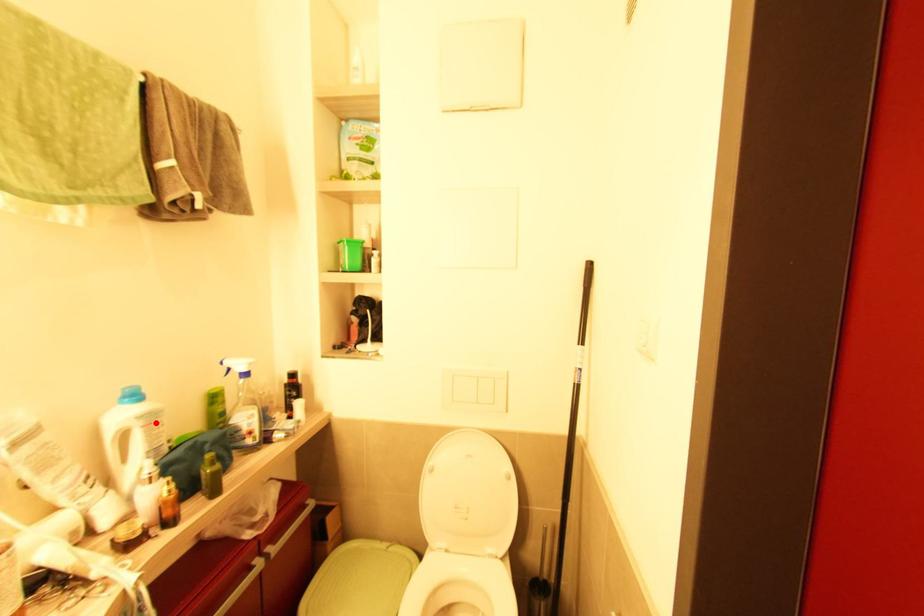
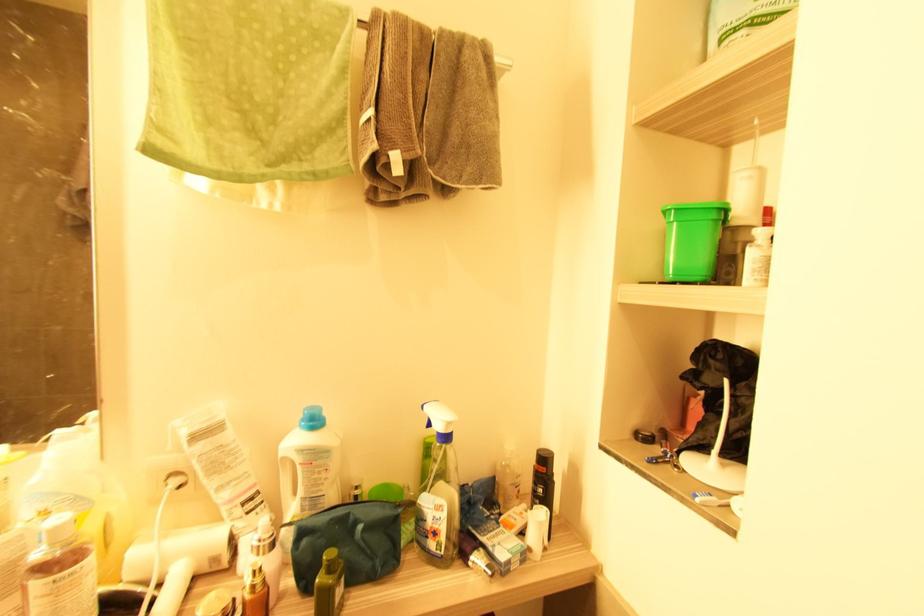
Where in the second image is the point corresponding to the highlighted location from the first image?

(315, 464)